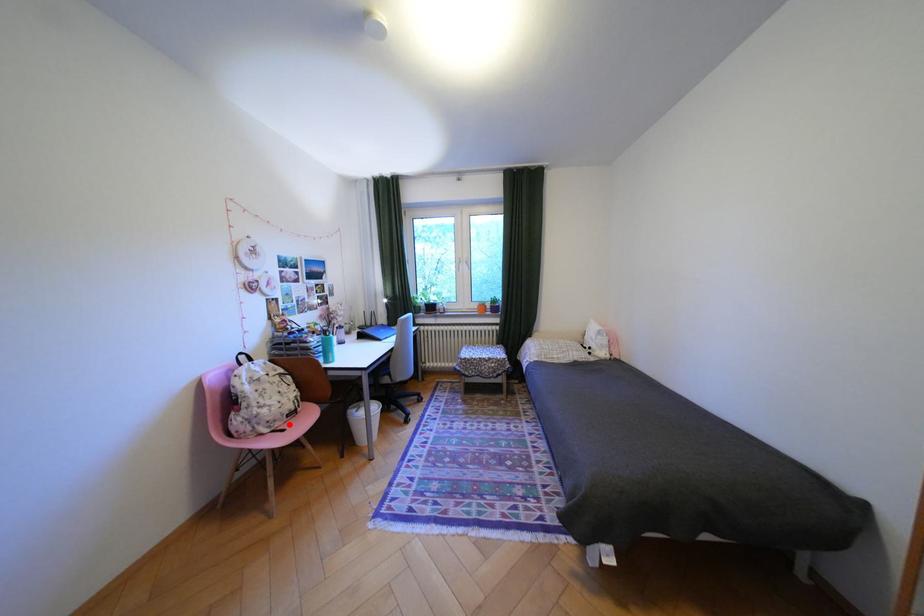
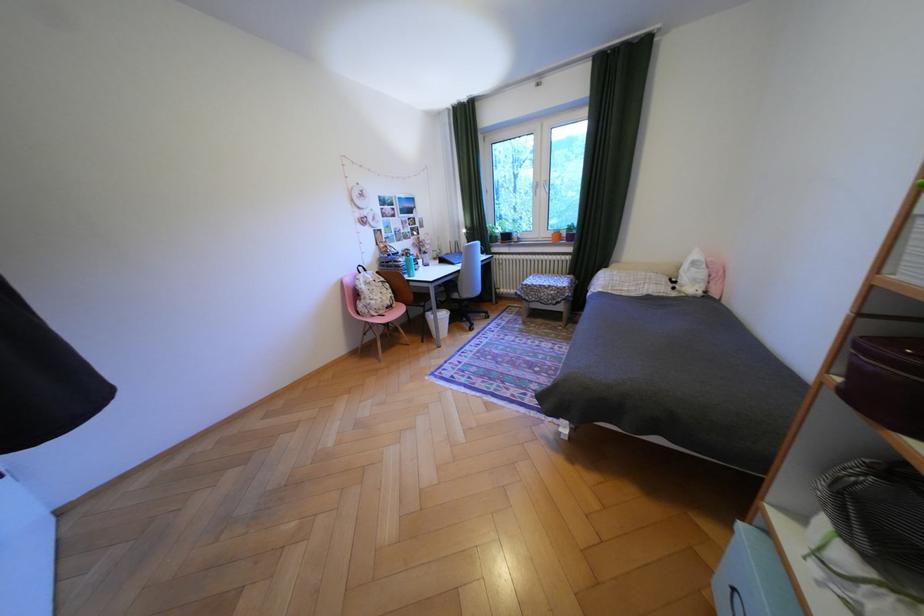
Question: A red point is marked in image1. In image2, is the corresponding 3D point closer to the camera or farther? Reply with the corresponding letter.

Choices:
 (A) The corresponding 3D point is closer.
 (B) The corresponding 3D point is farther.

Answer: (A)